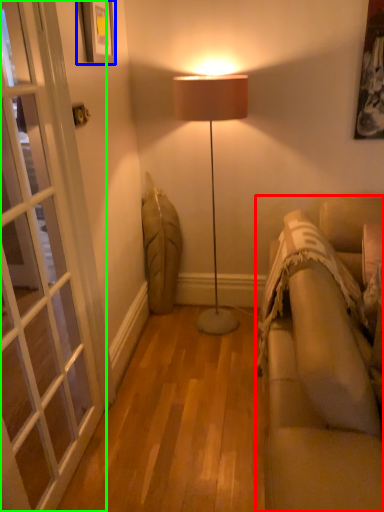
Question: Which is farther away from studio couch (highlighted by a red box)? picture frame (highlighted by a blue box) or screen door (highlighted by a green box)?

Choices:
 (A) picture frame
 (B) screen door

Answer: (A)